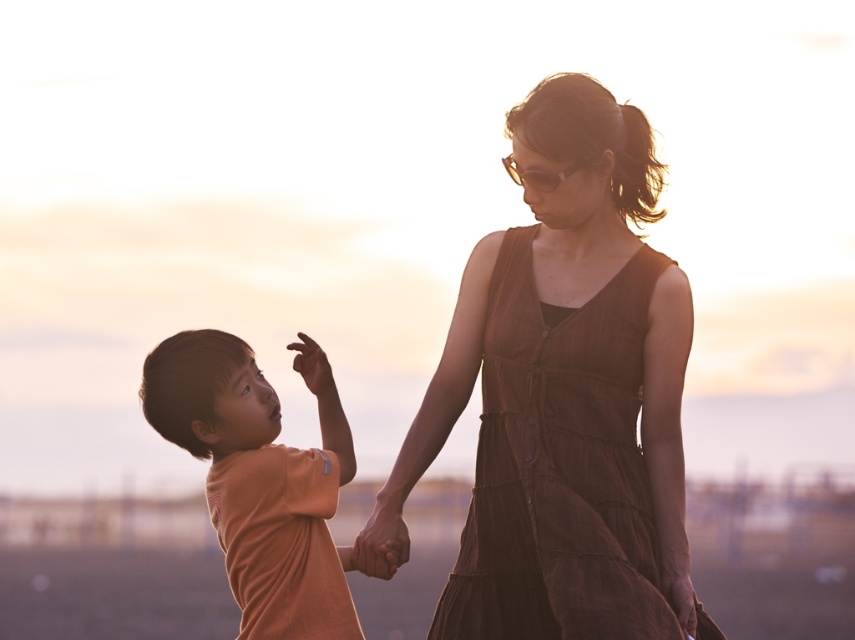
Is point (553, 332) closer to camera compared to point (268, 596)?

That is False.

Who is higher up, brown textured dress at center or orange cotton shirt at left?

Positioned higher is brown textured dress at center.

Which is behind, point (528, 240) or point (180, 426)?

Point (528, 240)

Identify the location of brown textured dress at center. (559, 467).

Does point (307, 612) come in front of point (544, 177)?

That is True.

Is orange cotton shirt at left below gold reflective sunglasses at upper center?

Indeed, orange cotton shirt at left is positioned under gold reflective sunglasses at upper center.

Which is behind, point (314, 372) or point (570, 170)?

The point (570, 170) is behind.

Locate an element on the screen. Image resolution: width=855 pixels, height=640 pixels. orange cotton shirt at left is located at coordinates (261, 480).

Which of these two, brown textured dress at center or gold reflective sunglasses at upper center, stands shorter?

gold reflective sunglasses at upper center

Who is lower down, brown textured dress at center or gold reflective sunglasses at upper center?

brown textured dress at center is lower down.

What do you see at coordinates (559, 467) in the screenshot? Image resolution: width=855 pixels, height=640 pixels. I see `brown textured dress at center` at bounding box center [559, 467].

You are a GUI agent. You are given a task and a screenshot of the screen. Output one action in this format:
    pyautogui.click(x=<x>, y=<y>)
    Task: Click on the brown textured dress at center
    
    Given the screenshot: What is the action you would take?
    pyautogui.click(x=559, y=467)